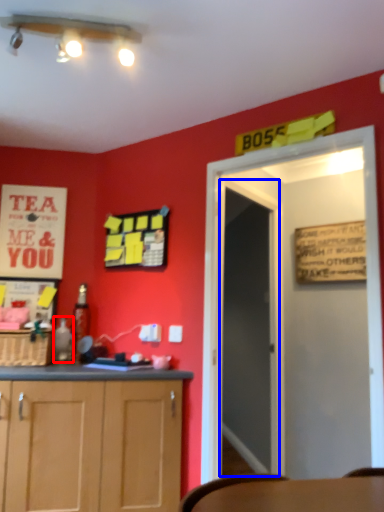
Question: Among these objects, which one is nearest to the camera, bottle (highlighted by a red box) or glass door (highlighted by a blue box)?

Choices:
 (A) bottle
 (B) glass door

Answer: (B)